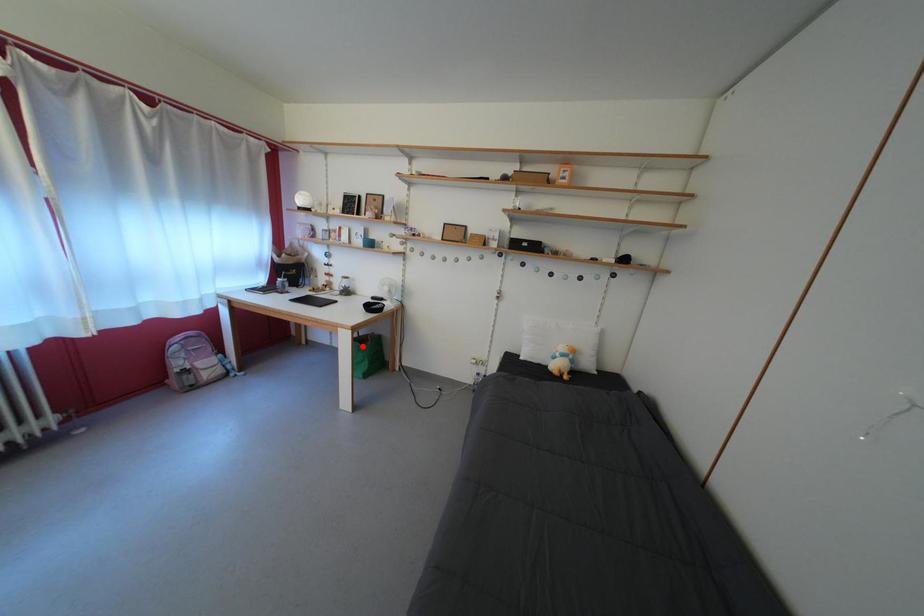
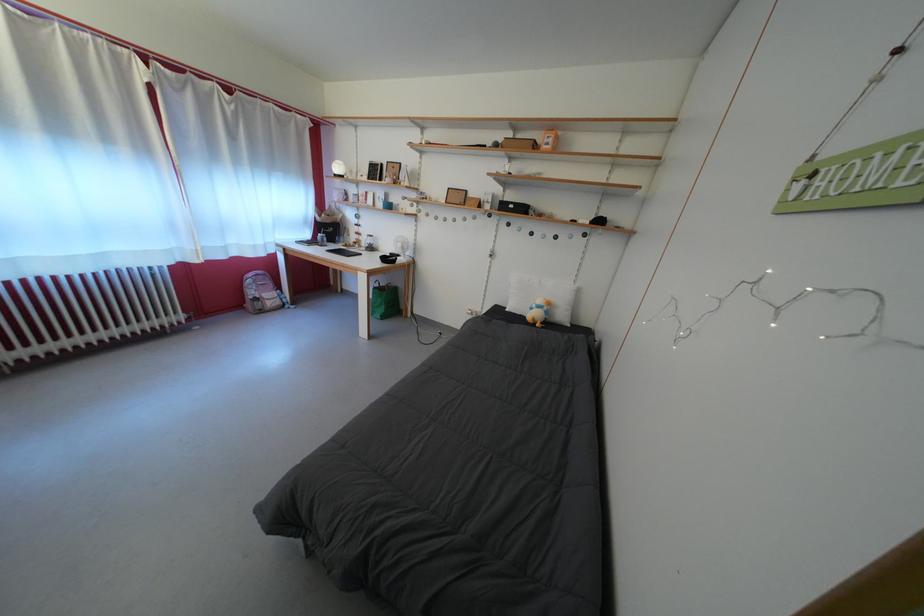
In the second image, find the point that corresponds to the highlighted location in the first image.

(383, 294)